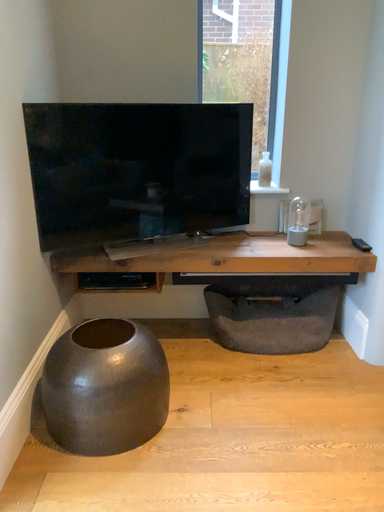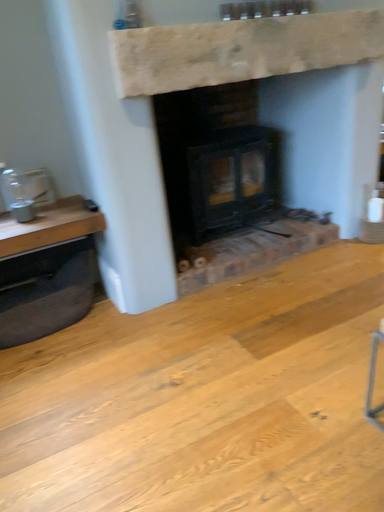
Question: Which way did the camera rotate in the video?

Choices:
 (A) rotated right
 (B) rotated left

Answer: (A)